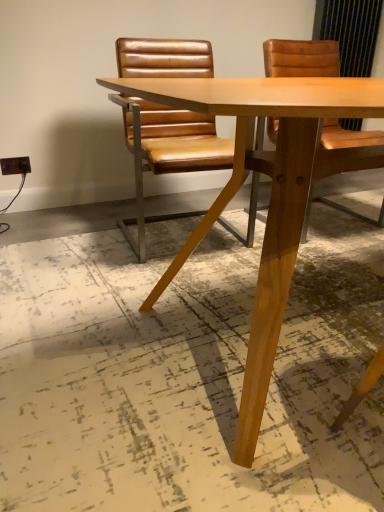
Question: Does light brown wood table at center have a larger size compared to brown leather chair at center?

Choices:
 (A) yes
 (B) no

Answer: (A)

Question: Is light brown wood table at center aimed at brown leather chair at center?

Choices:
 (A) yes
 (B) no

Answer: (B)

Question: Is light brown wood table at center not near brown leather chair at center?

Choices:
 (A) yes
 (B) no

Answer: (B)

Question: Could brown leather chair at center be considered to be inside light brown wood table at center?

Choices:
 (A) yes
 (B) no

Answer: (B)

Question: Is light brown wood table at center next to brown leather chair at center and touching it?

Choices:
 (A) no
 (B) yes

Answer: (A)

Question: From a real-world perspective, is light brown wood table at center on top of brown leather chair at center?

Choices:
 (A) no
 (B) yes

Answer: (A)

Question: From the image's perspective, would you say brown leather chair at center is shown under light brown wood table at center?

Choices:
 (A) no
 (B) yes

Answer: (A)

Question: Does brown leather chair at center have a greater height compared to light brown wood table at center?

Choices:
 (A) no
 (B) yes

Answer: (B)

Question: Is brown leather chair at center not within light brown wood table at center?

Choices:
 (A) no
 (B) yes

Answer: (B)

Question: From a real-world perspective, is brown leather chair at center on light brown wood table at center?

Choices:
 (A) yes
 (B) no

Answer: (A)

Question: From the image's perspective, is brown leather chair at center on top of light brown wood table at center?

Choices:
 (A) yes
 (B) no

Answer: (A)

Question: Is brown leather chair at center wider than light brown wood table at center?

Choices:
 (A) yes
 (B) no

Answer: (B)

Question: Considering the positions of brown leather chair at center and light brown wood table at center in the image, is brown leather chair at center taller or shorter than light brown wood table at center?

Choices:
 (A) tall
 (B) short

Answer: (A)